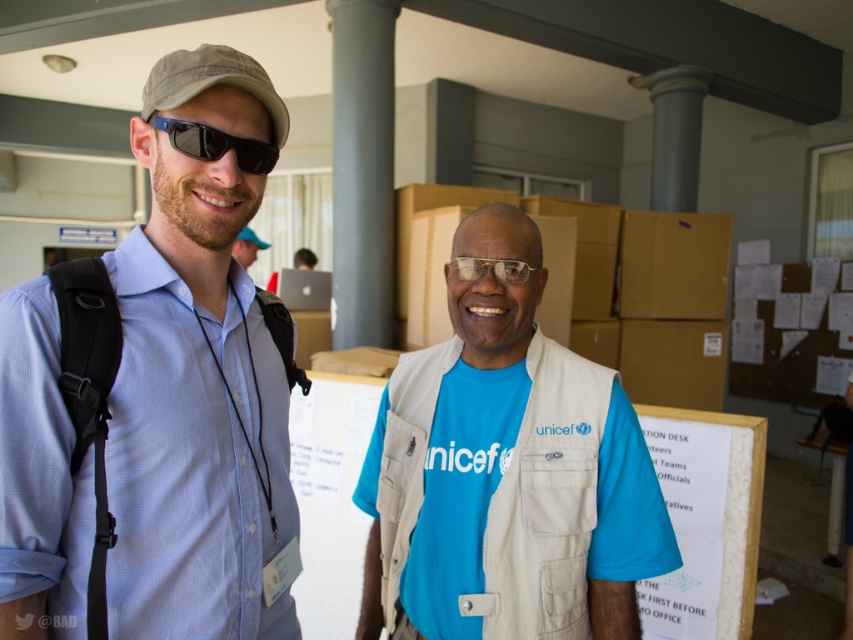
From the picture: You are a photographer trying to capture both the light blue shirt at center and the transparent plastic glasses at center in a single frame. Given that the camera can only focus on one object at a time, which object should you focus on to ensure it appears larger in the final photo?

The light blue shirt at center has a larger size compared to transparent plastic glasses at center. Therefore, focusing on the light blue shirt at center will ensure it appears larger in the photo.

You are a photographer trying to take a photo of the matte black backpack at left without including the sunglasses at left in the frame. Based on their positions, is this possible?

The sunglasses at left is positioned on the right side of matte black backpack at left, so if you position your camera to the left side of the backpack, you can capture the matte black backpack at left without including the sunglasses at left in the frame.